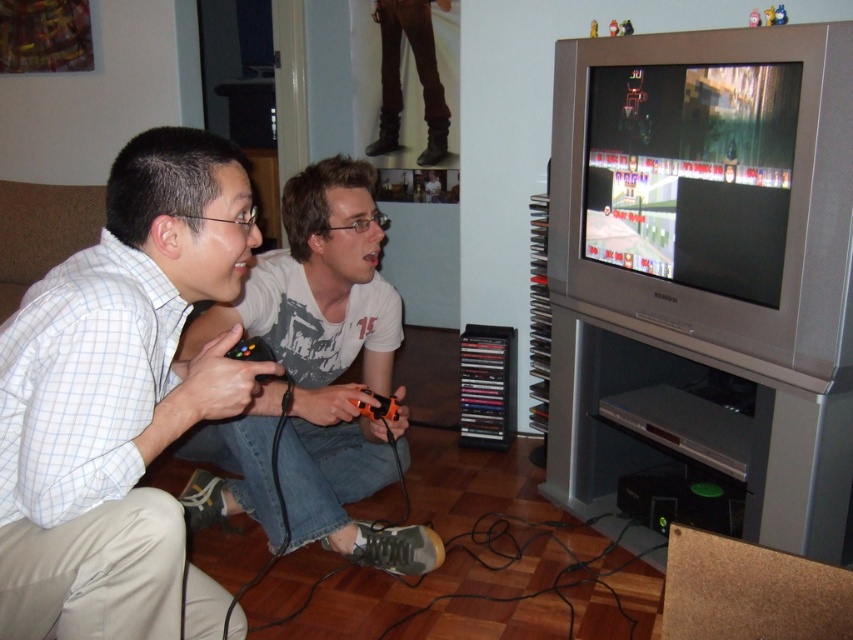
Is point (173, 228) positioned in front of point (312, 307)?

Yes, it is in front of point (312, 307).

Between light blue checkered shirt at lower left and matte gray shirt at center, which one appears on the right side from the viewer's perspective?

Positioned to the right is matte gray shirt at center.

Is point (3, 605) behind point (238, 458)?

No.

This screenshot has width=853, height=640. Find the location of `light blue checkered shirt at lower left`. light blue checkered shirt at lower left is located at coordinates (120, 397).